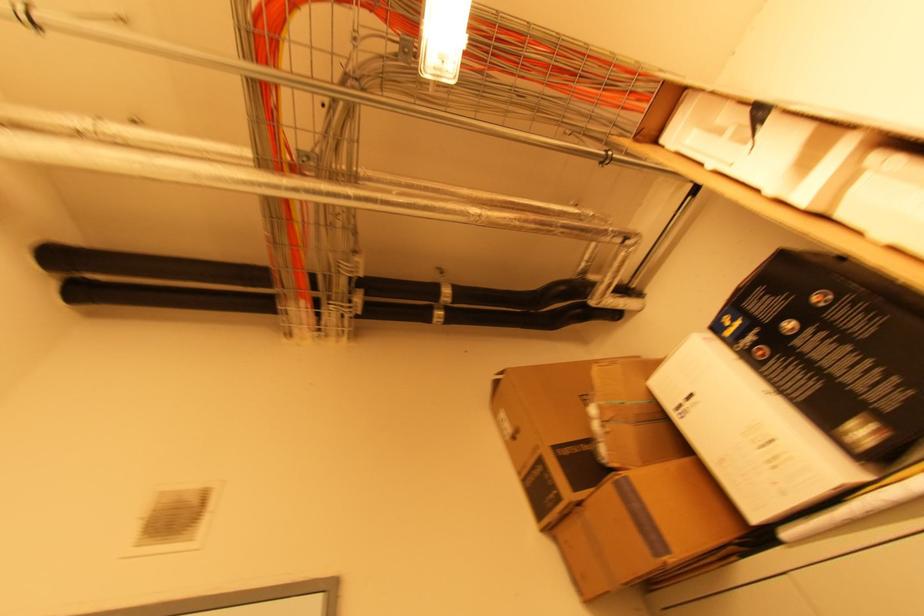
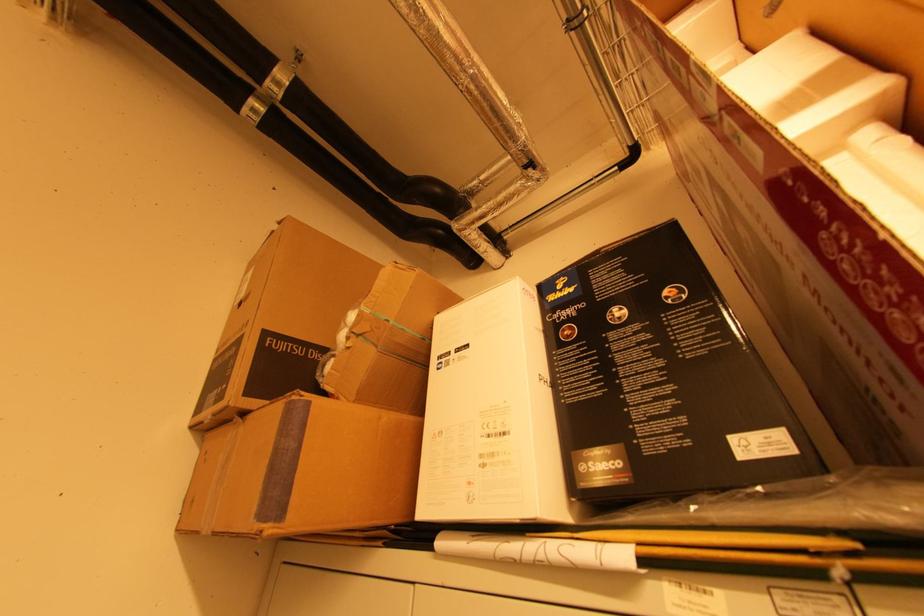
Locate, in the second image, the point that corresponds to the point at 861,148 in the first image.

(862, 107)